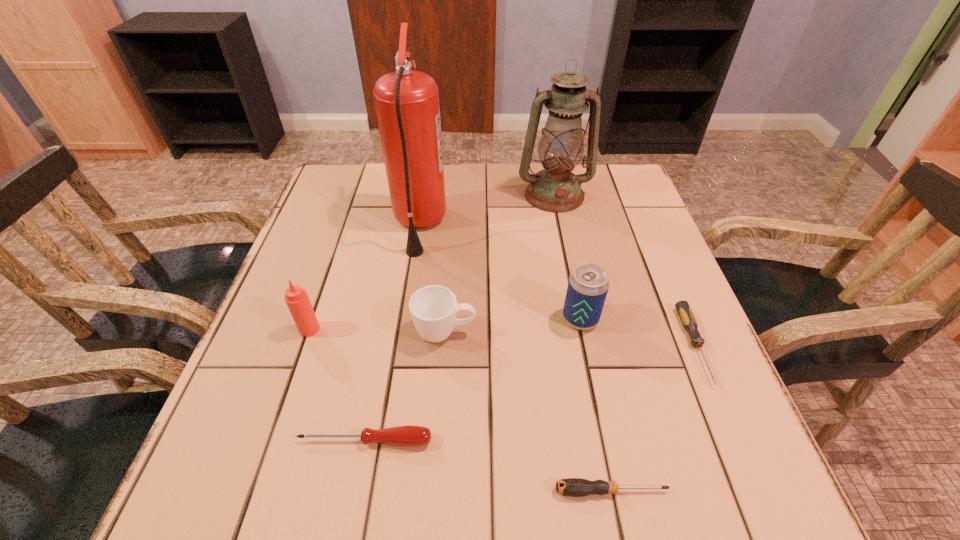
Locate an element on the screen. vacant area between the seventh shortest object and the beer can is located at coordinates (567, 257).

The width and height of the screenshot is (960, 540). What are the coordinates of `vacant space that is in between the nearest screwdriver and the cup` in the screenshot? It's located at (528, 411).

This screenshot has height=540, width=960. Find the location of `empty space that is in between the rightmost screwdriver and the nearest object`. empty space that is in between the rightmost screwdriver and the nearest object is located at coordinates (653, 418).

At what (x,y) coordinates should I click in order to perform the action: click on free spot between the farthest screwdriver and the leftmost object. Please return your answer as a coordinate pair (x, y). Looking at the image, I should click on (502, 338).

The width and height of the screenshot is (960, 540). Identify the location of the seventh closest object to the second screwdriver from right to left. (555, 189).

Identify the location of object that is the closest to the tallest screwdriver. (433, 308).

Choose which screwdriver is the nearest neighbor to the leftmost object. Please provide its 2D coordinates. Your answer should be formatted as a tuple, i.e. [(x, y)], where the tuple contains the x and y coordinates of a point satisfying the conditions above.

[(410, 435)]

The height and width of the screenshot is (540, 960). Find the location of `screwdriver that stands as the third closest to the beer can`. screwdriver that stands as the third closest to the beer can is located at coordinates coord(410,435).

Locate an element on the screen. free space that satisfies the following two spatial constraints: 1. on the instruction side of the tallest object; 2. on the right side of the beer can is located at coordinates (404, 319).

The image size is (960, 540). What are the coordinates of `vacant region that satisfies the following two spatial constraints: 1. on the instruction side of the tallest object; 2. on the front side of the Tabasco sauce` in the screenshot? It's located at (403, 329).